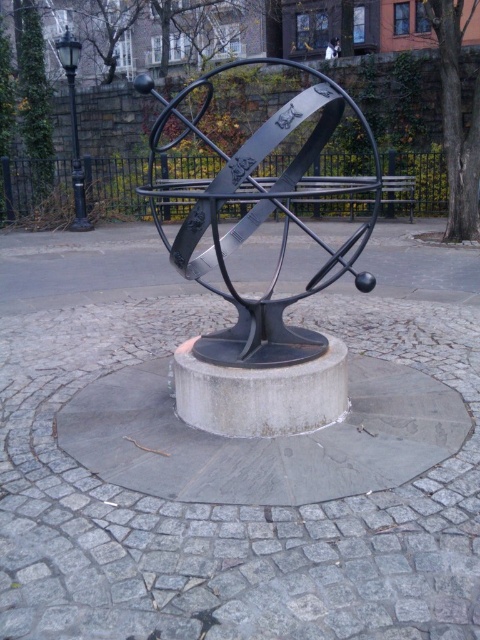
Can you confirm if black metal sculpture at center is positioned to the left of metallic park bench at center?

Indeed, black metal sculpture at center is positioned on the left side of metallic park bench at center.

Who is more distant from viewer, (274, 205) or (345, 202)?

The point (345, 202) is behind.

Find the location of `black metal sculpture at center`. black metal sculpture at center is located at coordinates (260, 216).